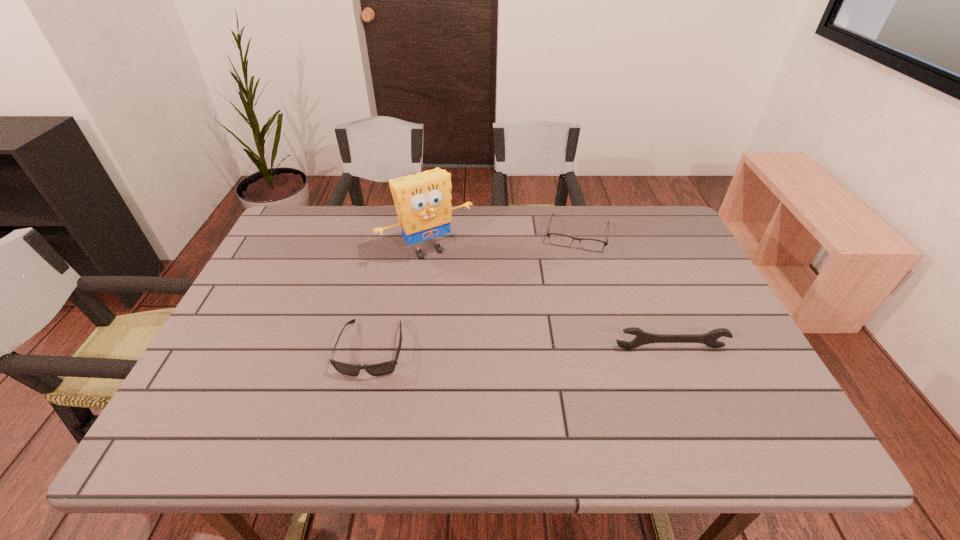
This screenshot has height=540, width=960. In the image, there is a desktop. What are the coordinates of `free region at the near left corner` in the screenshot? It's located at (207, 405).

Image resolution: width=960 pixels, height=540 pixels. In the image, there is a desktop. Find the location of `vacant space at the far right corner`. vacant space at the far right corner is located at coordinates (641, 241).

You are a GUI agent. You are given a task and a screenshot of the screen. Output one action in this format:
    pyautogui.click(x=<x>, y=<y>)
    Task: Click on the vacant space in between the third shortest object and the sunglasses
    Image resolution: width=960 pixels, height=540 pixels.
    Given the screenshot: What is the action you would take?
    pyautogui.click(x=521, y=348)

Where is `free space between the sunglasses and the tallest object`? This screenshot has width=960, height=540. free space between the sunglasses and the tallest object is located at coordinates (400, 300).

What are the coordinates of `vacant region between the tallest object and the sunglasses` in the screenshot? It's located at (400, 300).

The height and width of the screenshot is (540, 960). I want to click on vacant space that is in between the sunglasses and the spectacles, so click(475, 291).

Locate an element on the screen. vacant area between the wrench and the sunglasses is located at coordinates (521, 348).

This screenshot has height=540, width=960. In order to click on free point between the tallest object and the wrench in this screenshot , I will do `click(549, 299)`.

Where is `vacant space in between the spectacles and the sunglasses`? Image resolution: width=960 pixels, height=540 pixels. vacant space in between the spectacles and the sunglasses is located at coordinates (475, 291).

Identify the location of free space between the tallest object and the spectacles. tap(503, 242).